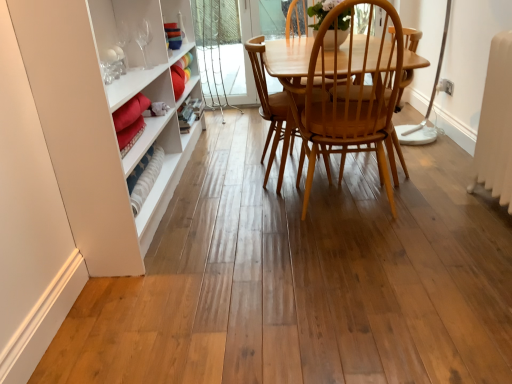
Identify the location of vacant space to the left of light brown wood chair at center. The image size is (512, 384). (x=225, y=180).